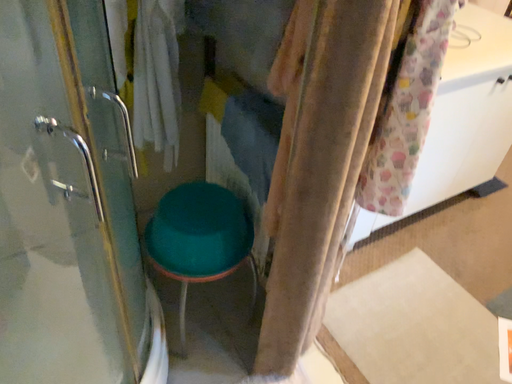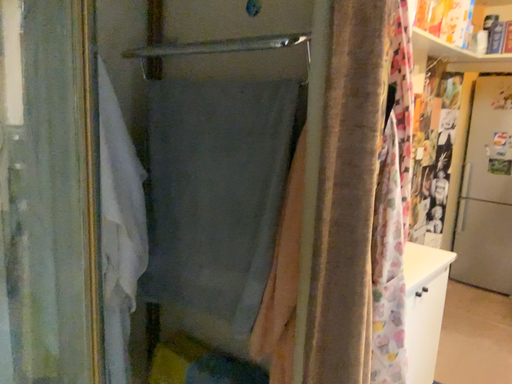
Question: How did the camera likely rotate when shooting the video?

Choices:
 (A) rotated upward
 (B) rotated downward

Answer: (A)